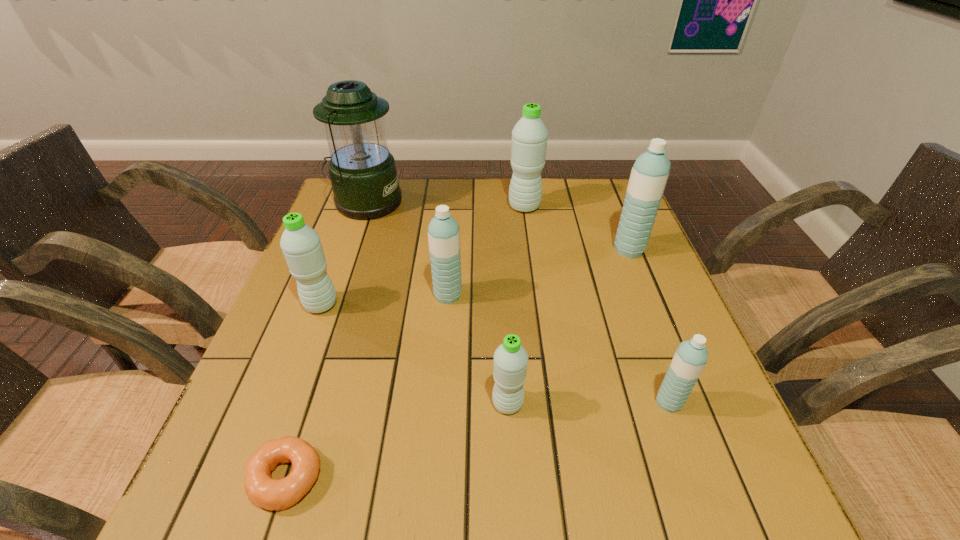
You are a GUI agent. You are given a task and a screenshot of the screen. Output one action in this format:
    pyautogui.click(x=<x>, y=<y>)
    Task: Click on the third closest green water bottle to the second farthest blue water bottle
    The height and width of the screenshot is (540, 960).
    Given the screenshot: What is the action you would take?
    coord(529,136)

The image size is (960, 540). What are the coordinates of `blue water bottle identified as the second closest to the biggest blue water bottle` in the screenshot? It's located at (444, 232).

Choose which blue water bottle is the nearest neighbor to the leftmost green water bottle. Please provide its 2D coordinates. Your answer should be formatted as a tuple, i.e. [(x, y)], where the tuple contains the x and y coordinates of a point satisfying the conditions above.

[(444, 232)]

Identify the location of vacant space that satisfies the following two spatial constraints: 1. on the front side of the green lantern; 2. on the right side of the nearest blue water bottle. (296, 402).

You are a GUI agent. You are given a task and a screenshot of the screen. Output one action in this format:
    pyautogui.click(x=<x>, y=<y>)
    Task: Click on the vacant area that satisfies the following two spatial constraints: 1. on the back side of the lantern; 2. on the right side of the leftmost water bottle
    This screenshot has height=540, width=960.
    Given the screenshot: What is the action you would take?
    pyautogui.click(x=359, y=202)